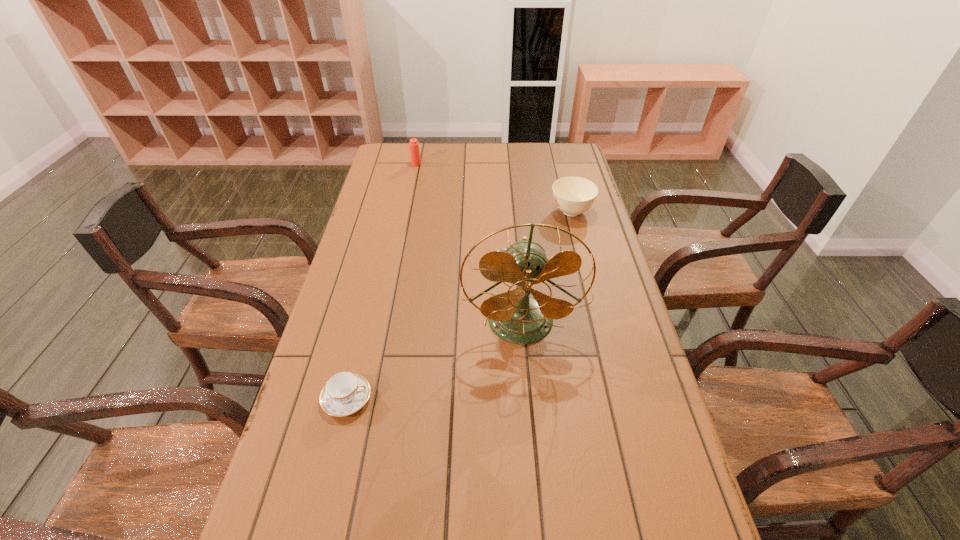
Identify which object is the nearest to the sugar bowl. Please provide its 2D coordinates. Your answer should be formatted as a tuple, i.e. [(x, y)], where the tuple contains the x and y coordinates of a point satisfying the conditions above.

[(514, 316)]

Choose which object is the third nearest neighbor to the tallest object. Please provide its 2D coordinates. Your answer should be formatted as a tuple, i.e. [(x, y)], where the tuple contains the x and y coordinates of a point satisfying the conditions above.

[(413, 144)]